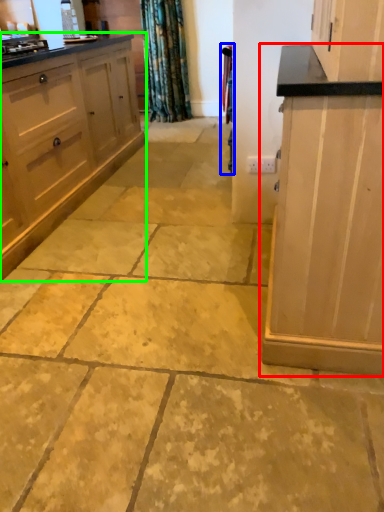
Question: Based on their relative distances, which object is nearer to cabinetry (highlighted by a red box)? Choose from curtain (highlighted by a blue box) and cabinetry (highlighted by a green box).

Choices:
 (A) curtain
 (B) cabinetry

Answer: (A)